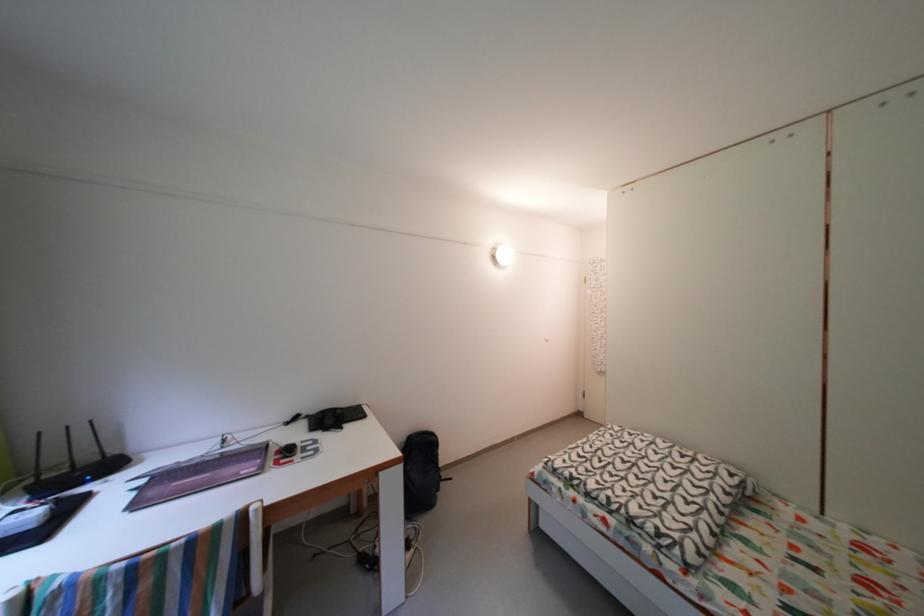
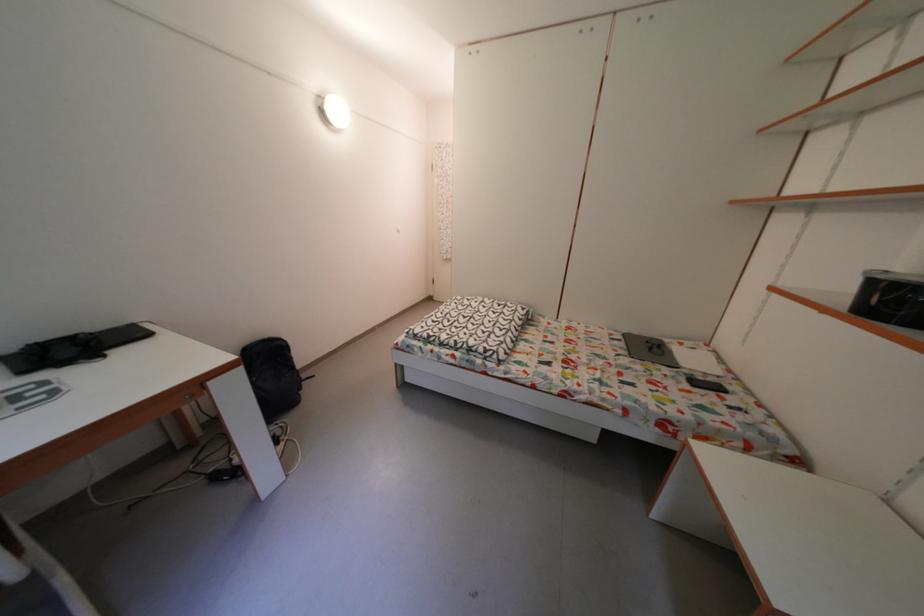
Where in the second image is the point corresponding to (317,422) from the first image?

(6, 363)